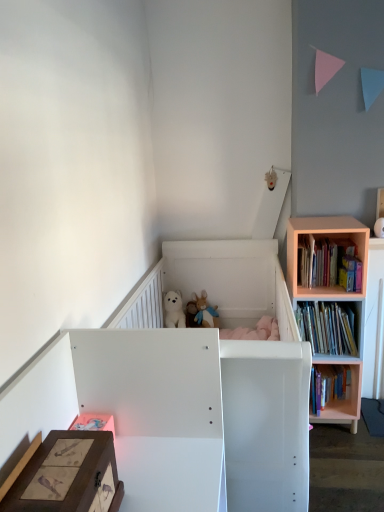
Question: From a real-world perspective, relative to hardcover book at right, the 1th book from the bottom, is wooden storage box at lower left vertically above or below?

Choices:
 (A) below
 (B) above

Answer: (B)

Question: Based on their sizes in the image, would you say wooden storage box at lower left is bigger or smaller than hardcover book at right, arranged as the third book when viewed from the top?

Choices:
 (A) small
 (B) big

Answer: (A)

Question: Which object is the farthest from the matte white vase at upper right, the first toy from the front?

Choices:
 (A) hardcover books at right, the 2th book ordered from the bottom
 (B) wooden storage box at lower left
 (C) fluffy plush toys at center, which is counted as the 2th toy, starting from the top
 (D) white matte infant bed at center
 (E) hardcover book at right, arranged as the third book when viewed from the top

Answer: (B)

Question: Which is farther from the hardcover books at right, which is the 2th book from top to bottom?

Choices:
 (A) fluffy plush toys at center, acting as the second toy starting from the right
 (B) wooden storage box at lower left
 (C) pink wood bookshelf at right
 (D) wooden bookshelf at right, positioned as the 3th book in bottom-to-top order
 (E) hardcover book at right, arranged as the third book when viewed from the top

Answer: (B)